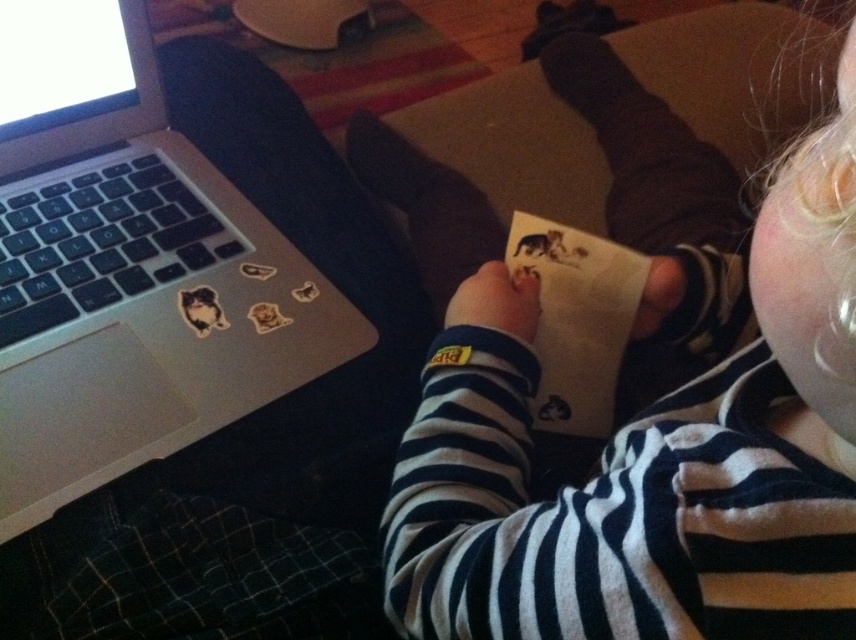
Question: Does white striped shirt at center appear over silver metallic laptop at left?

Choices:
 (A) yes
 (B) no

Answer: (A)

Question: Is white striped shirt at center bigger than silver metallic laptop at left?

Choices:
 (A) yes
 (B) no

Answer: (A)

Question: Which point is farther to the camera?

Choices:
 (A) (64, 156)
 (B) (545, 339)

Answer: (A)

Question: Among these objects, which one is nearest to the camera?

Choices:
 (A) silver metallic laptop at left
 (B) white striped shirt at center
 (C) white paper at center

Answer: (B)

Question: Which of the following is the farthest from the observer?

Choices:
 (A) (645, 580)
 (B) (535, 339)
 (C) (238, 301)

Answer: (C)

Question: In this image, where is white striped shirt at center located relative to silver metallic laptop at left?

Choices:
 (A) right
 (B) left

Answer: (A)